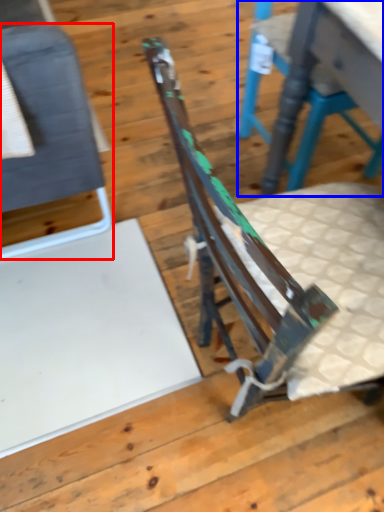
Question: Which object is further to the camera taking this photo, chair (highlighted by a red box) or chair (highlighted by a blue box)?

Choices:
 (A) chair
 (B) chair

Answer: (B)